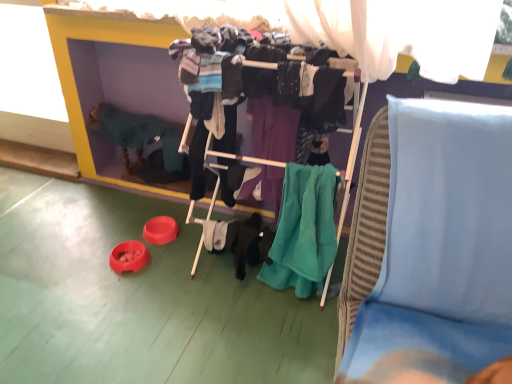
Question: Considering the relative positions of teal fabric clothes at center and light blue fabric at upper right in the image provided, is teal fabric clothes at center to the left or to the right of light blue fabric at upper right?

Choices:
 (A) right
 (B) left

Answer: (B)

Question: Do you think teal fabric clothes at center is within light blue fabric at upper right, or outside of it?

Choices:
 (A) inside
 (B) outside

Answer: (B)

Question: Which is farther from the teal soft towel at center?

Choices:
 (A) teal fabric clothes at center
 (B) knitted green sweater at left
 (C) light blue fabric at upper right

Answer: (B)

Question: Considering the real-world distances, which object is farthest from the teal soft towel at center?

Choices:
 (A) knitted green sweater at left
 (B) teal fabric clothes at center
 (C) light blue fabric at upper right

Answer: (A)